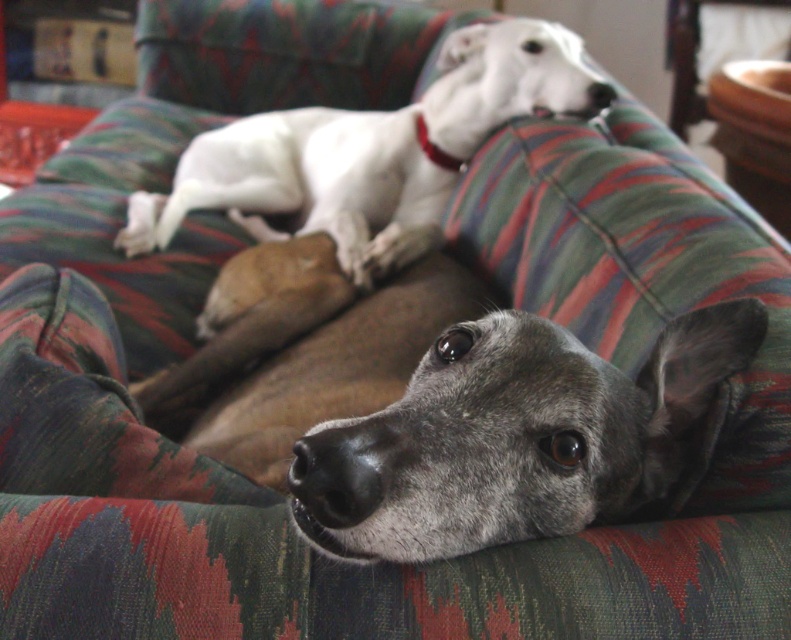
Question: Does white smooth dog at upper center come in front of red leather neckband at center?

Choices:
 (A) yes
 (B) no

Answer: (A)

Question: Can you confirm if gray fur dog at center is positioned to the right of white smooth dog at upper center?

Choices:
 (A) no
 (B) yes

Answer: (B)

Question: Which object is farther from the camera taking this photo?

Choices:
 (A) gray fur dog at center
 (B) white smooth dog at upper center
 (C) red leather neckband at center

Answer: (C)

Question: Based on their relative distances, which object is farther from the white smooth dog at upper center?

Choices:
 (A) red leather neckband at center
 (B) gray fur dog at center

Answer: (B)

Question: Is gray fur dog at center thinner than red leather neckband at center?

Choices:
 (A) no
 (B) yes

Answer: (A)

Question: Which is nearer to the red leather neckband at center?

Choices:
 (A) gray fur dog at center
 (B) white smooth dog at upper center

Answer: (B)